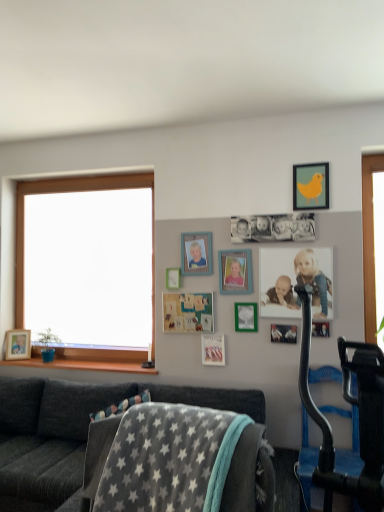
Locate an element on the screen. vacant region above wooden at left (from a real-world perspective) is located at coordinates (81, 362).